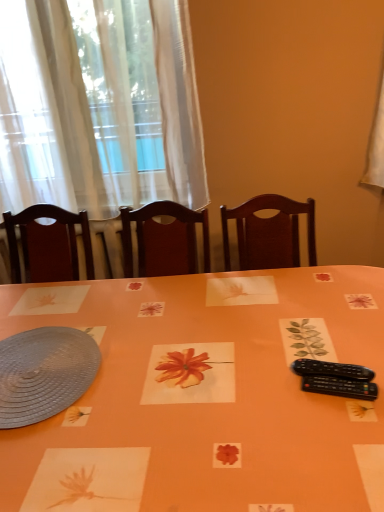
Question: Can you see white sheer curtain at upper left touching black plastic remote at lower right?

Choices:
 (A) yes
 (B) no

Answer: (B)

Question: Can black plastic remote at lower right be found inside white sheer curtain at upper left?

Choices:
 (A) no
 (B) yes

Answer: (A)

Question: Considering the relative positions of white sheer curtain at upper left and black plastic remote at lower right in the image provided, is white sheer curtain at upper left to the right of black plastic remote at lower right from the viewer's perspective?

Choices:
 (A) no
 (B) yes

Answer: (A)

Question: Considering the relative sizes of white sheer curtain at upper left and black plastic remote at lower right in the image provided, is white sheer curtain at upper left smaller than black plastic remote at lower right?

Choices:
 (A) yes
 (B) no

Answer: (B)

Question: Is white sheer curtain at upper left oriented towards black plastic remote at lower right?

Choices:
 (A) yes
 (B) no

Answer: (A)

Question: Is white sheer curtain at upper left in front of or behind black plastic remote at lower right in the image?

Choices:
 (A) behind
 (B) front

Answer: (A)

Question: Considering the positions of point (64, 100) and point (369, 392), is point (64, 100) closer or farther from the camera than point (369, 392)?

Choices:
 (A) closer
 (B) farther

Answer: (B)

Question: Considering the positions of white sheer curtain at upper left and black plastic remote at lower right in the image, is white sheer curtain at upper left bigger or smaller than black plastic remote at lower right?

Choices:
 (A) big
 (B) small

Answer: (A)

Question: Is white sheer curtain at upper left spatially inside black plastic remote at lower right, or outside of it?

Choices:
 (A) outside
 (B) inside

Answer: (A)

Question: Considering the positions of white sheer curtain at upper left and orange paper placemat at center in the image, is white sheer curtain at upper left taller or shorter than orange paper placemat at center?

Choices:
 (A) short
 (B) tall

Answer: (B)

Question: Is white sheer curtain at upper left situated inside orange paper placemat at center or outside?

Choices:
 (A) outside
 (B) inside

Answer: (A)

Question: Relative to orange paper placemat at center, is white sheer curtain at upper left in front or behind?

Choices:
 (A) front
 (B) behind

Answer: (B)

Question: Looking at their shapes, would you say white sheer curtain at upper left is wider or thinner than orange paper placemat at center?

Choices:
 (A) wide
 (B) thin

Answer: (B)

Question: From a real-world perspective, is black plastic remote at lower right positioned above or below orange paper placemat at center?

Choices:
 (A) above
 (B) below

Answer: (A)

Question: Is black plastic remote at lower right spatially inside orange paper placemat at center, or outside of it?

Choices:
 (A) inside
 (B) outside

Answer: (A)